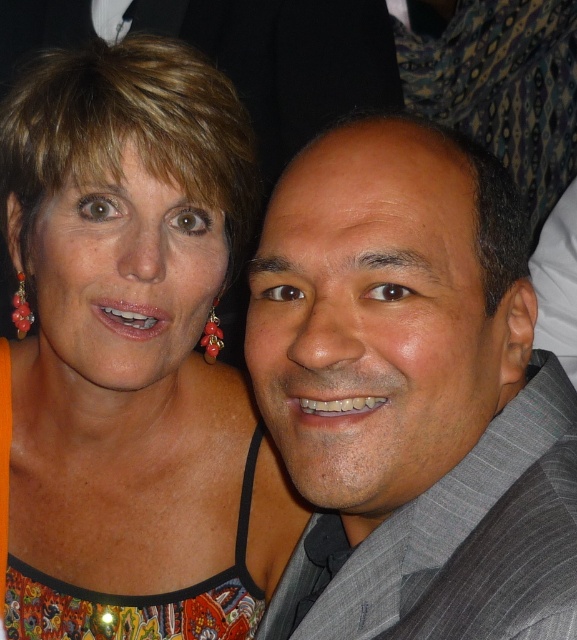
Describe the element at coordinates (132, 355) in the screenshot. I see `multicolored fabric dress at upper left` at that location.

Is multicolored fabric dress at upper left positioned at the back of gray textured suit at center?

Yes, it is behind gray textured suit at center.

Is point (35, 208) closer to camera compared to point (395, 154)?

That is False.

What are the coordinates of `multicolored fabric dress at upper left` in the screenshot? It's located at (132, 355).